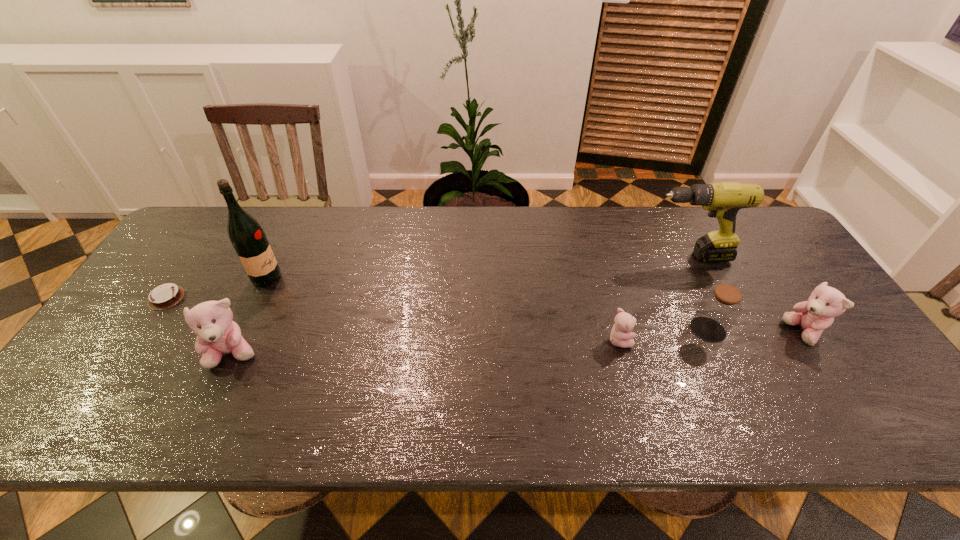
This screenshot has width=960, height=540. Identify the location of vacant position for inserting another teddy_bear evenly. click(429, 347).